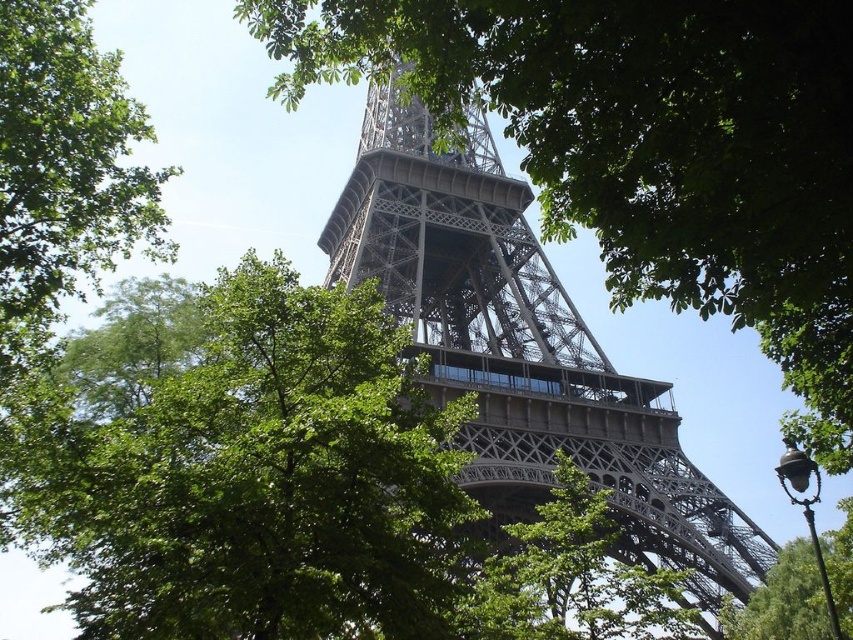
Question: Which object appears farthest from the camera in this image?

Choices:
 (A) green leafy tree at center
 (B) green leafy tree at lower right
 (C) green leafy tree at upper left
 (D) metallic gray tower at center

Answer: (B)

Question: Which point is farther to the camera?

Choices:
 (A) metallic gray tower at center
 (B) green leafy tree at lower right
 (C) green leafy tree at center
 (D) green leafy tree at upper left

Answer: (B)

Question: Is green leafy tree at center to the left of green leafy tree at lower right from the viewer's perspective?

Choices:
 (A) no
 (B) yes

Answer: (B)

Question: Observing the image, what is the correct spatial positioning of green leafy tree at center in reference to metallic gray tower at center?

Choices:
 (A) below
 (B) above

Answer: (A)

Question: Among these objects, which one is farthest from the camera?

Choices:
 (A) green leafy tree at lower right
 (B) metallic gray tower at center
 (C) green leafy tree at upper left
 (D) green leafy tree at center

Answer: (A)

Question: Observing the image, what is the correct spatial positioning of green leafy tree at center in reference to green leafy tree at upper left?

Choices:
 (A) left
 (B) right

Answer: (B)